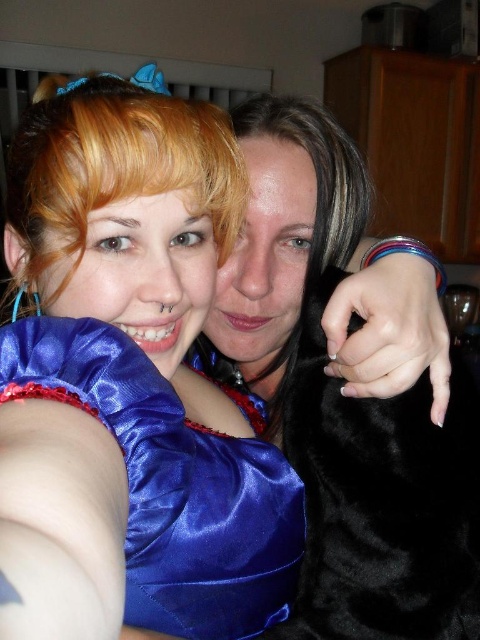
Question: From the image, what is the correct spatial relationship of satin blue dress at upper left in relation to blonde silky hair at upper left?

Choices:
 (A) right
 (B) left

Answer: (A)

Question: Which point is farther from the camera taking this photo?

Choices:
 (A) (139, 387)
 (B) (60, 118)

Answer: (B)

Question: Which object is closer to the camera taking this photo?

Choices:
 (A) black fur coat at right
 (B) satin blue dress at upper left
 (C) blonde silky hair at upper left

Answer: (B)

Question: Can you confirm if satin blue dress at upper left is positioned to the right of black fur coat at right?

Choices:
 (A) yes
 (B) no

Answer: (B)

Question: Is satin blue dress at upper left above black fur coat at right?

Choices:
 (A) yes
 (B) no

Answer: (A)

Question: Which point appears closest to the camera in this image?

Choices:
 (A) (393, 266)
 (B) (172, 198)

Answer: (B)